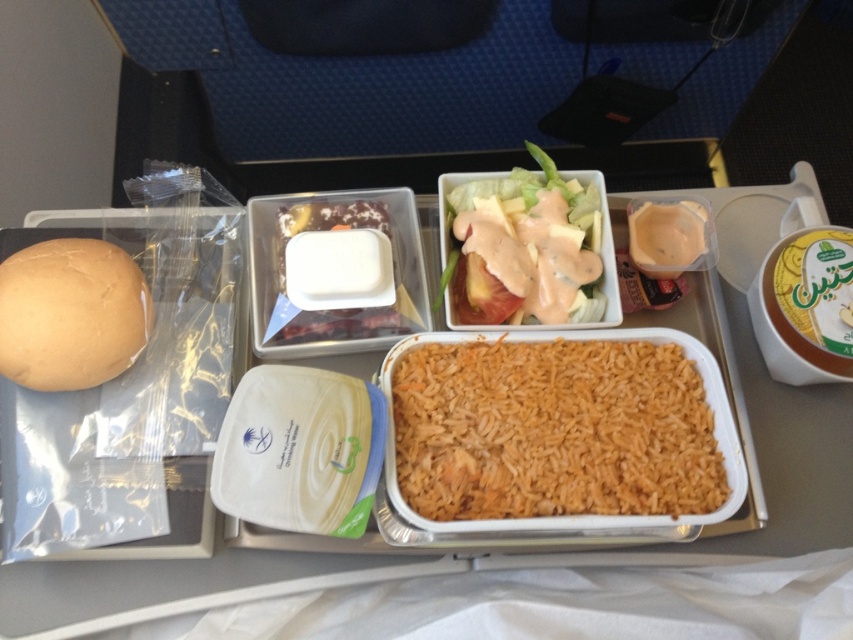
Question: Can you confirm if orange matte rice at center is positioned below matte plastic salad at center?

Choices:
 (A) no
 (B) yes

Answer: (B)

Question: Which of the following is the farthest from the observer?

Choices:
 (A) (521, 444)
 (B) (4, 369)
 (C) (573, 316)
 (D) (679, 205)

Answer: (D)

Question: Can you confirm if brown matte rice at center is smaller than golden matte bun at left?

Choices:
 (A) yes
 (B) no

Answer: (B)

Question: Which object appears farthest from the camera in this image?

Choices:
 (A) orange matte rice at center
 (B) golden matte bun at left

Answer: (A)

Question: Among these objects, which one is nearest to the camera?

Choices:
 (A) matte plastic sauce at upper right
 (B) orange matte rice at center

Answer: (B)

Question: Where is brown matte rice at center located in relation to golden matte bun at left in the image?

Choices:
 (A) left
 (B) right

Answer: (B)